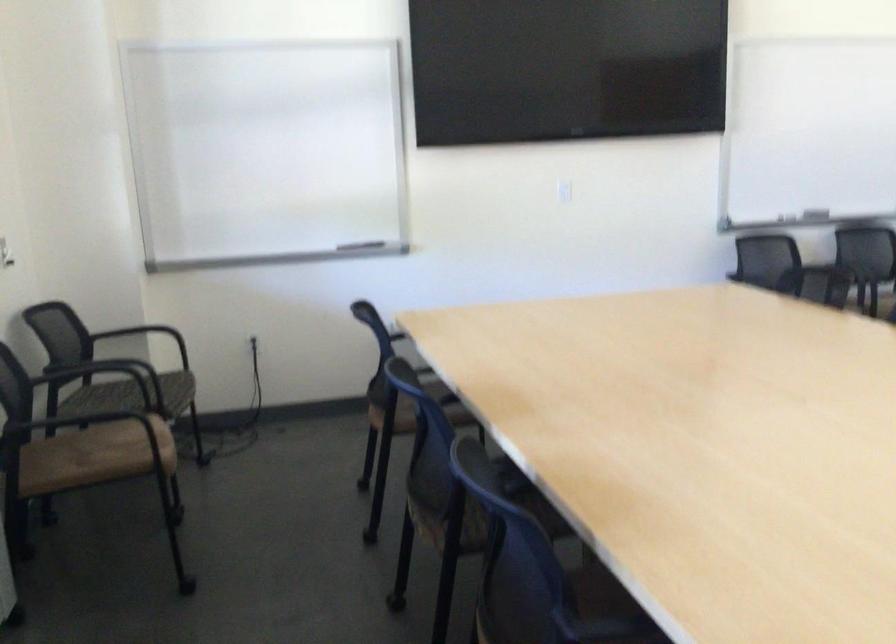
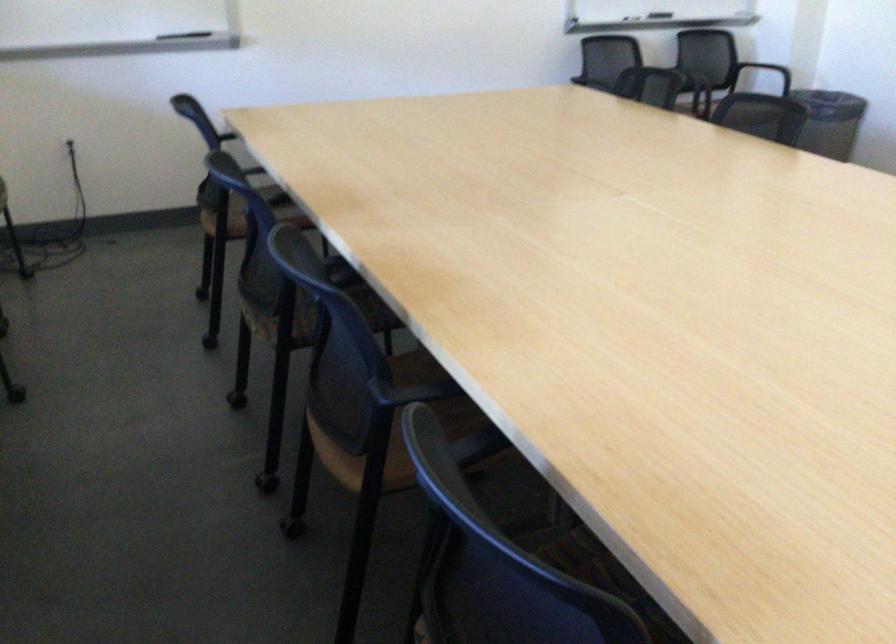
Where in the second image is the point corresponding to (815,205) from the first image?

(655, 15)